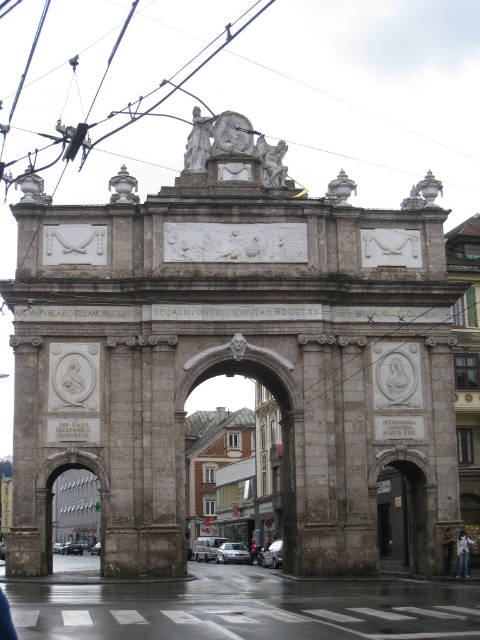
Based on the photo, does polished stone statue at center have a lesser width compared to brown leather jacket at center?

No, polished stone statue at center is not thinner than brown leather jacket at center.

Can you confirm if polished stone statue at center is positioned to the left of brown leather jacket at center?

Indeed, polished stone statue at center is positioned on the left side of brown leather jacket at center.

The image size is (480, 640). Describe the element at coordinates (272, 161) in the screenshot. I see `polished stone statue at center` at that location.

Identify the location of polished stone statue at center. The image size is (480, 640). (272, 161).

Between gray stone archway at center and brown leather jacket at center, which one is positioned higher?

gray stone archway at center is higher up.

Which is behind, point (251, 502) or point (445, 554)?

Positioned behind is point (251, 502).

Does point (192, 497) come behind point (454, 540)?

Yes, it is behind point (454, 540).

I want to click on gray stone archway at center, so click(230, 468).

Who is taller, polished stone statue at center or blurred fabric person at center?

Standing taller between the two is polished stone statue at center.

Which is in front, point (256, 145) or point (466, 536)?

Point (466, 536)

The width and height of the screenshot is (480, 640). What are the coordinates of `polished stone statue at center` in the screenshot? It's located at (272, 161).